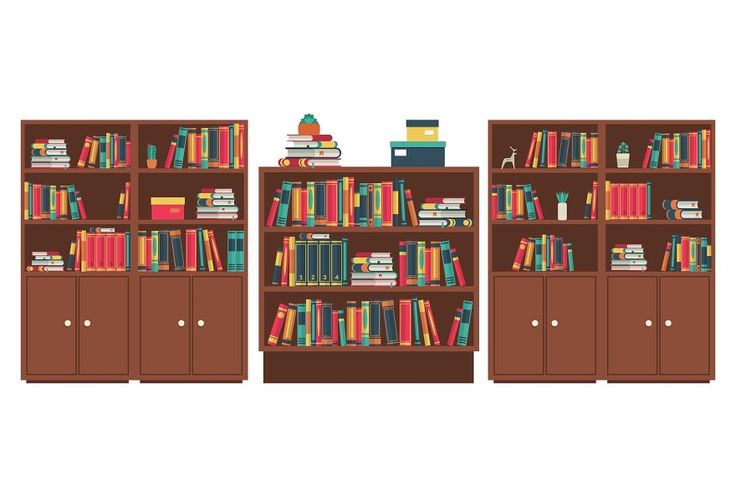
Locate an element on the screen. Image resolution: width=736 pixels, height=490 pixels. decorations on shelves is located at coordinates (151, 156), (311, 125), (414, 127), (414, 157), (503, 159), (559, 204), (619, 157), (173, 208).